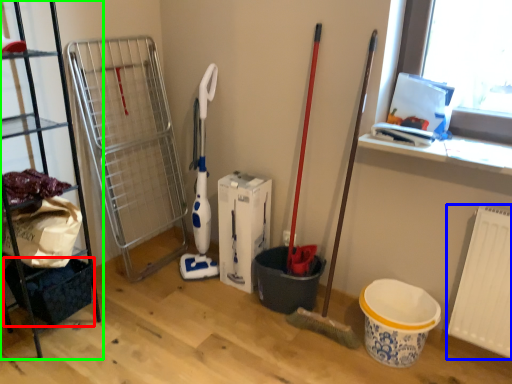
Question: Considering the real-world distances, which object is closest to basket (highlighted by a red box)? radiator (highlighted by a blue box) or shelf (highlighted by a green box).

Choices:
 (A) radiator
 (B) shelf

Answer: (B)